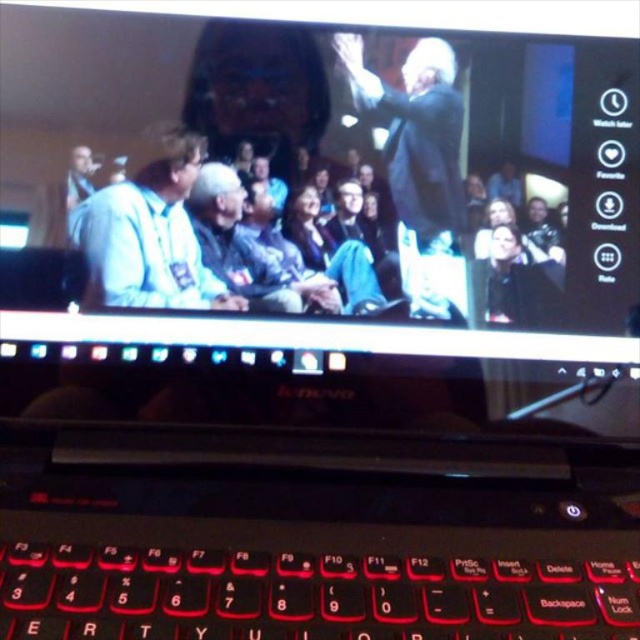
Looking at this image, does black plastic keyboard at bottom have a greater width compared to dark gray suit at upper center?

Yes, black plastic keyboard at bottom is wider than dark gray suit at upper center.

Which is more to the left, black plastic keyboard at bottom or dark gray suit at upper center?

black plastic keyboard at bottom is more to the left.

Is point (180, 595) closer to camera compared to point (362, 84)?

Yes, point (180, 595) is in front of point (362, 84).

The height and width of the screenshot is (640, 640). I want to click on black plastic keyboard at bottom, so click(307, 595).

Can you confirm if light blue fabric shirt at left is wider than black matte jacket at lower right?

Indeed, light blue fabric shirt at left has a greater width compared to black matte jacket at lower right.

Can you confirm if light blue fabric shirt at left is positioned to the right of black matte jacket at lower right?

Incorrect, light blue fabric shirt at left is not on the right side of black matte jacket at lower right.

Is point (100, 260) positioned before point (557, 291)?

Yes, it is.

Where is `light blue fabric shirt at left`? This screenshot has width=640, height=640. light blue fabric shirt at left is located at coordinates (148, 237).

Which is above, black plastic keyboard at bottom or black matte jacket at lower right?

black matte jacket at lower right is above.

Who is positioned more to the right, black plastic keyboard at bottom or black matte jacket at lower right?

black matte jacket at lower right is more to the right.

The width and height of the screenshot is (640, 640). What are the coordinates of `black plastic keyboard at bottom` in the screenshot? It's located at (307, 595).

This screenshot has height=640, width=640. I want to click on black plastic keyboard at bottom, so click(x=307, y=595).